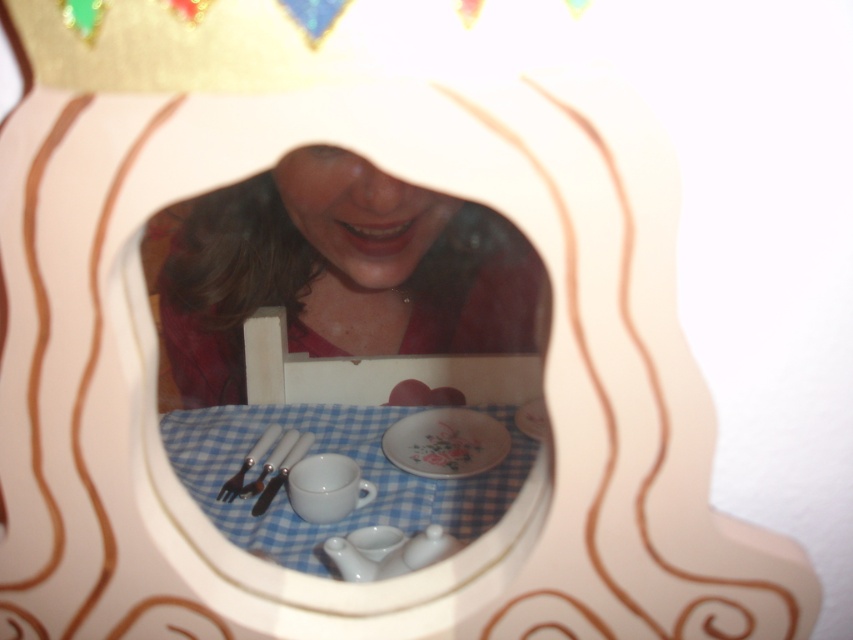
Describe the element at coordinates (341, 280) in the screenshot. This screenshot has height=640, width=853. I see `white glossy mirror at center` at that location.

Is white glossy mirror at center positioned before satin silver fork at lower center?

That is False.

Does point (323, 237) come in front of point (257, 448)?

No, (323, 237) is further to viewer.

Locate an element on the screen. This screenshot has width=853, height=640. white glossy mirror at center is located at coordinates (341, 280).

Between blue checkered tablecloth at center and floral porcelain plate at center, which one is positioned lower?

blue checkered tablecloth at center is lower down.

Between blue checkered tablecloth at center and floral porcelain plate at center, which one appears on the right side from the viewer's perspective?

Positioned to the right is floral porcelain plate at center.

Who is more forward, (505, 461) or (438, 419)?

Point (505, 461)

You are a GUI agent. You are given a task and a screenshot of the screen. Output one action in this format:
    pyautogui.click(x=<x>, y=<y>)
    Task: Click on the blue checkered tablecloth at center
    The height and width of the screenshot is (640, 853).
    Given the screenshot: What is the action you would take?
    pyautogui.click(x=338, y=452)

Find the location of a particular element. Image resolution: width=853 pixels, height=640 pixels. blue checkered tablecloth at center is located at coordinates (338, 452).

Does blue checkered tablecloth at center appear on the left side of satin silver fork at lower center?

In fact, blue checkered tablecloth at center is to the right of satin silver fork at lower center.

Between point (451, 484) and point (258, 442), which one is positioned behind?

Point (258, 442)

Locate an element on the screen. This screenshot has height=640, width=853. blue checkered tablecloth at center is located at coordinates (338, 452).